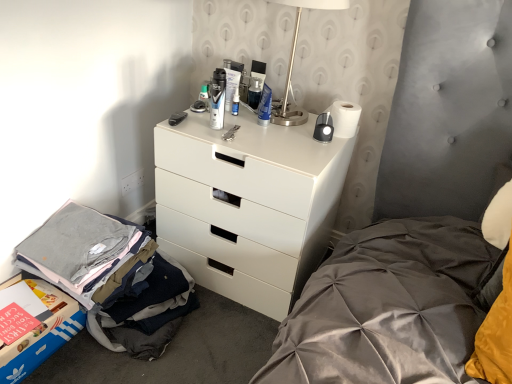
Locate an element on the screen. Image resolution: width=512 pixels, height=384 pixels. vacant point to the left of blue plastic tube at center, positioned as the 5th toiletry in left-to-right order is located at coordinates (218, 122).